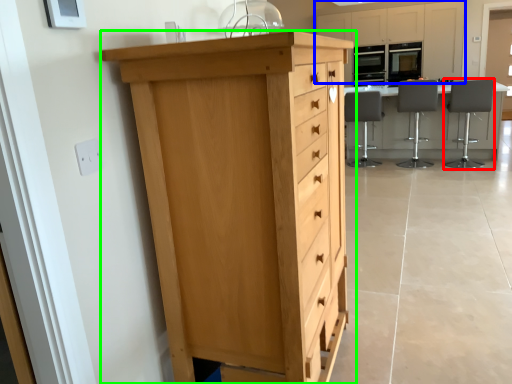
Question: Based on their relative distances, which object is nearer to chair (highlighted by a red box)? Choose from cabinetry (highlighted by a blue box) and chest of drawers (highlighted by a green box).

Choices:
 (A) cabinetry
 (B) chest of drawers

Answer: (A)